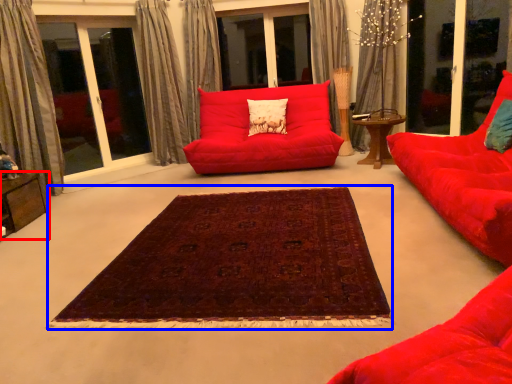
Question: Among these objects, which one is farthest to the camera, table (highlighted by a red box) or mat (highlighted by a blue box)?

Choices:
 (A) table
 (B) mat

Answer: (A)